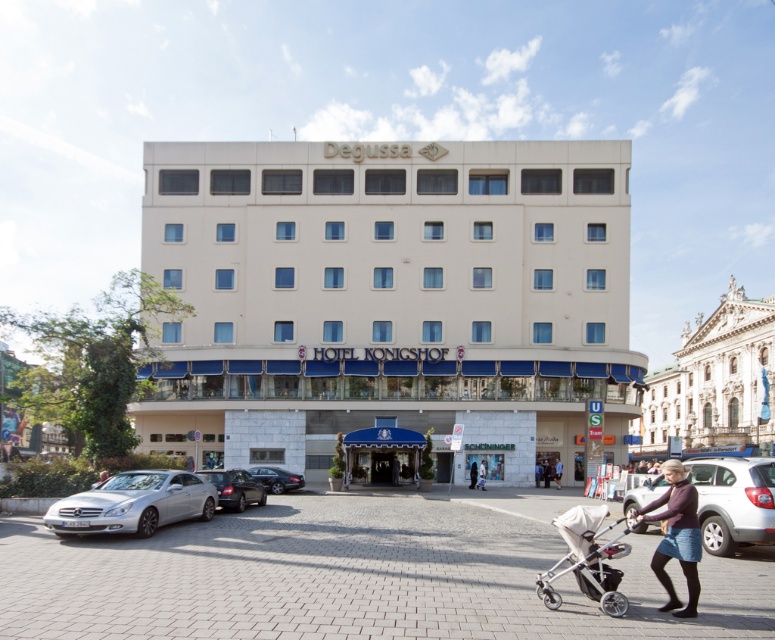
Looking at this image, is shiny silver sedan at lower left to the left of dark gray sweater at center from the viewer's perspective?

Correct, you'll find shiny silver sedan at lower left to the left of dark gray sweater at center.

Which of these two, shiny silver sedan at lower left or dark gray sweater at center, stands shorter?

Result: Standing shorter between the two is dark gray sweater at center.

Where is `shiny silver sedan at lower left`? This screenshot has height=640, width=775. shiny silver sedan at lower left is located at coordinates (236, 486).

Who is shorter, white marble building at upper right or silver metallic stroller at lower right?

Standing shorter between the two is silver metallic stroller at lower right.

Between point (746, 320) and point (584, 548), which one is positioned in front?

Point (584, 548)

In order to click on white marble building at upper right in this screenshot , I will do `click(715, 380)`.

Can you confirm if white marble building at upper right is thinner than silver metallic car at lower right?

Incorrect, white marble building at upper right's width is not less than silver metallic car at lower right's.

Does white marble building at upper right appear under silver metallic car at lower right?

Correct, white marble building at upper right is located below silver metallic car at lower right.

Does point (748, 406) come in front of point (749, 474)?

No, it is not.

Locate an element on the screen. The image size is (775, 640). white marble building at upper right is located at coordinates (715, 380).